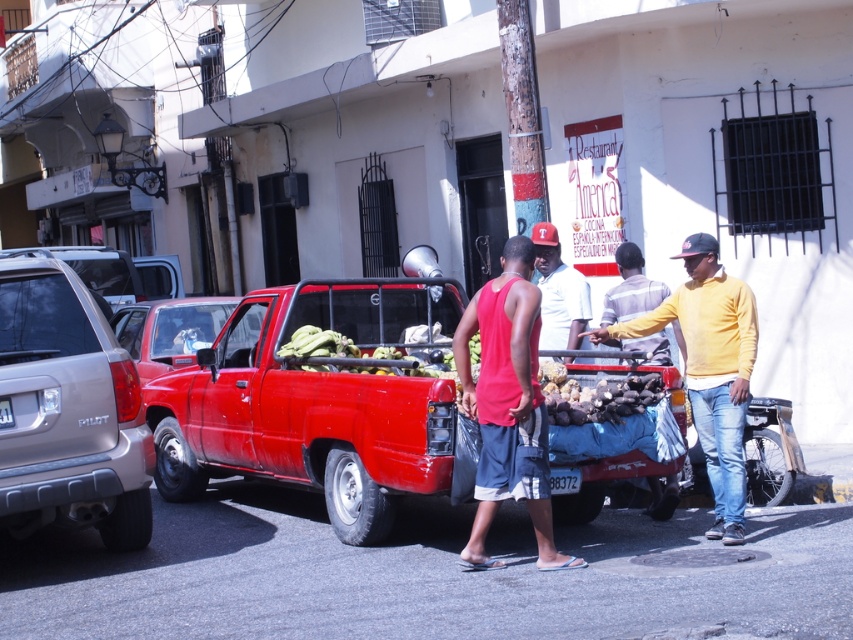
You are a delivery person who needs to hand over a package to the person wearing the red matte tank top at center. The metallic red truck at center is blocking your path. Can you walk around the truck to reach them?

The red matte tank top at center is smaller than the metallic red truck at center, so you can walk around the truck to reach the person wearing the red matte tank top at center.

You are a delivery driver who needs to park your shiny red truck at center in a spot that requires clearance of 2 meters. The parking spot is located under a metallic red truck at center. Is there enough vertical clearance for your truck?

The shiny red truck at center is positioned under metallic red truck at center, but the Objects Description does not provide information about the vertical clearance between them. Therefore, it is impossible to determine if there is enough space.